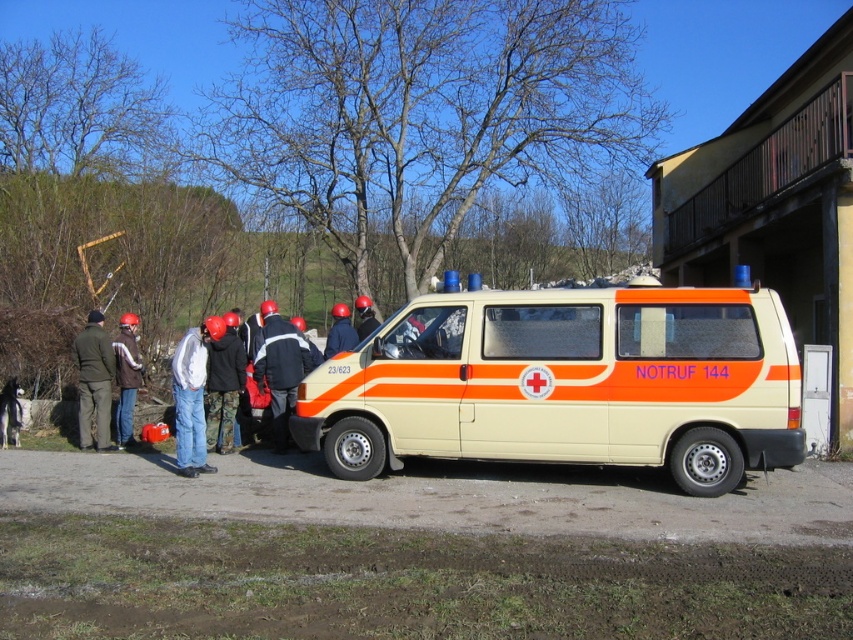
You are a delivery person who needs to place a khaki fabric jacket at left and a black fabric helmet at center into a storage box. The box has a height limit of 1 meter. Can both items fit vertically inside the box if placed upright?

The khaki fabric jacket at left is taller than the black fabric helmet at center. Since the box has a height limit of 1 meter, both items can fit vertically as long as the tallest item, the khaki fabric jacket at left, does not exceed 1 meter in height when upright.